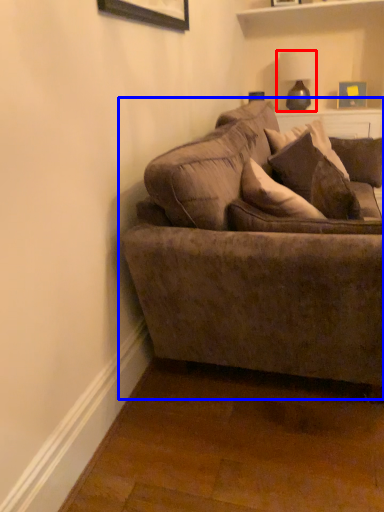
Question: Among these objects, which one is farthest to the camera, lamp (highlighted by a red box) or studio couch (highlighted by a blue box)?

Choices:
 (A) lamp
 (B) studio couch

Answer: (A)